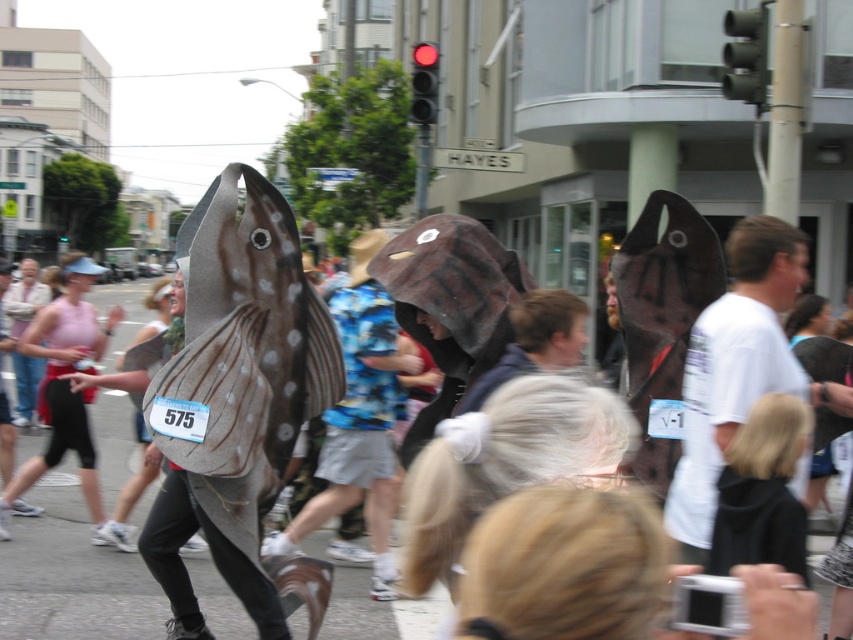
Does point (775, 340) come behind point (50, 346)?

That is False.

Is point (750, 278) in front of point (88, 480)?

Yes, it is.

This screenshot has height=640, width=853. Find the location of `white matte fish at right`. white matte fish at right is located at coordinates [734, 369].

Which of these two, white matte fish at right or spotted leather shark at center, stands shorter?

Standing shorter between the two is white matte fish at right.

Between white matte fish at right and spotted leather shark at center, which one is positioned higher?

white matte fish at right is higher up.

Image resolution: width=853 pixels, height=640 pixels. What do you see at coordinates (734, 369) in the screenshot?
I see `white matte fish at right` at bounding box center [734, 369].

Where is `white matte fish at right`? The image size is (853, 640). white matte fish at right is located at coordinates (734, 369).

Is spotted leather shark at center to the left of pink fabric tank top at left from the viewer's perspective?

No, spotted leather shark at center is not to the left of pink fabric tank top at left.

Between spotted leather shark at center and pink fabric tank top at left, which one is positioned higher?

pink fabric tank top at left is higher up.

Is point (352, 365) positioned after point (68, 259)?

No, it is in front of (68, 259).

Find the location of a particular element. The width and height of the screenshot is (853, 640). spotted leather shark at center is located at coordinates (360, 419).